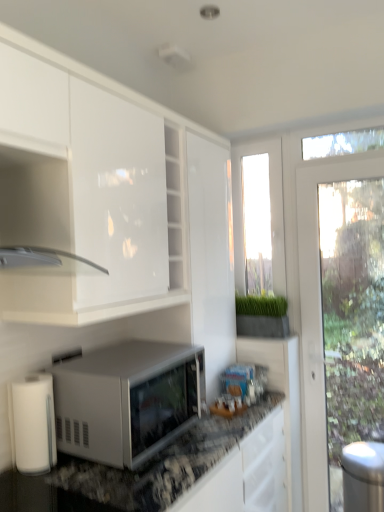
Question: From a real-world perspective, is white matte paper towel at lower left located higher than stainless steel trash can at right?

Choices:
 (A) no
 (B) yes

Answer: (B)

Question: From a real-world perspective, is white matte paper towel at lower left under stainless steel trash can at right?

Choices:
 (A) yes
 (B) no

Answer: (B)

Question: Does white matte paper towel at lower left turn towards stainless steel trash can at right?

Choices:
 (A) yes
 (B) no

Answer: (B)

Question: Is white matte paper towel at lower left not near stainless steel trash can at right?

Choices:
 (A) yes
 (B) no

Answer: (A)

Question: Can you confirm if white matte paper towel at lower left is smaller than stainless steel trash can at right?

Choices:
 (A) no
 (B) yes

Answer: (B)

Question: From a real-world perspective, is white matte paper towel at lower left physically located above or below stainless steel trash can at right?

Choices:
 (A) above
 (B) below

Answer: (A)

Question: Based on their sizes in the image, would you say white matte paper towel at lower left is bigger or smaller than stainless steel trash can at right?

Choices:
 (A) big
 (B) small

Answer: (B)

Question: From the image's perspective, is white matte paper towel at lower left above or below stainless steel trash can at right?

Choices:
 (A) below
 (B) above

Answer: (B)

Question: Is white matte paper towel at lower left to the left or to the right of stainless steel trash can at right in the image?

Choices:
 (A) right
 (B) left

Answer: (B)

Question: From the image's perspective, relative to transparent glass window at center, arranged as the first window screen when viewed from the left, is white matte paper towel at lower left above or below?

Choices:
 (A) above
 (B) below

Answer: (B)

Question: In terms of height, does white matte paper towel at lower left look taller or shorter compared to transparent glass window at center, arranged as the first window screen when viewed from the left?

Choices:
 (A) short
 (B) tall

Answer: (A)

Question: Considering the positions of white matte paper towel at lower left and transparent glass window at center, which is counted as the 2th window screen, starting from the right, in the image, is white matte paper towel at lower left wider or thinner than transparent glass window at center, which is counted as the 2th window screen, starting from the right,?

Choices:
 (A) thin
 (B) wide

Answer: (B)

Question: In the image, is white matte paper towel at lower left on the left side or the right side of transparent glass window at center, which is counted as the 2th window screen, starting from the right?

Choices:
 (A) left
 (B) right

Answer: (A)

Question: Relative to white matte microwave at center, is matte white cabinet at upper left in front or behind?

Choices:
 (A) front
 (B) behind

Answer: (A)

Question: Choose the correct answer: Is matte white cabinet at upper left inside white matte microwave at center or outside it?

Choices:
 (A) inside
 (B) outside

Answer: (B)